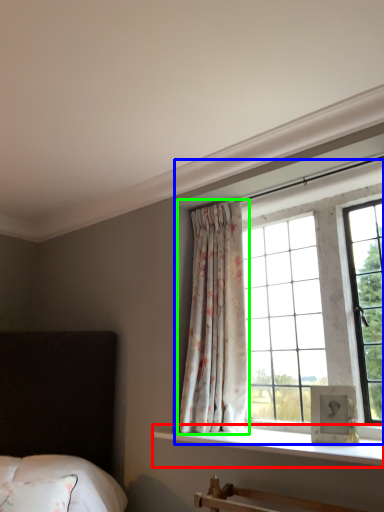
Question: Estimate the real-world distances between objects in this image. Which object is farther from window sill (highlighted by a red box), bay window (highlighted by a blue box) or curtain (highlighted by a green box)?

Choices:
 (A) bay window
 (B) curtain

Answer: (A)